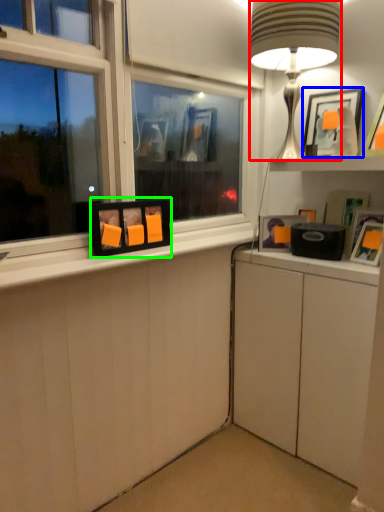
Question: Estimate the real-world distances between objects in this image. Which object is farther from table lamp (highlighted by a red box), picture frame (highlighted by a blue box) or picture frame (highlighted by a green box)?

Choices:
 (A) picture frame
 (B) picture frame

Answer: (B)